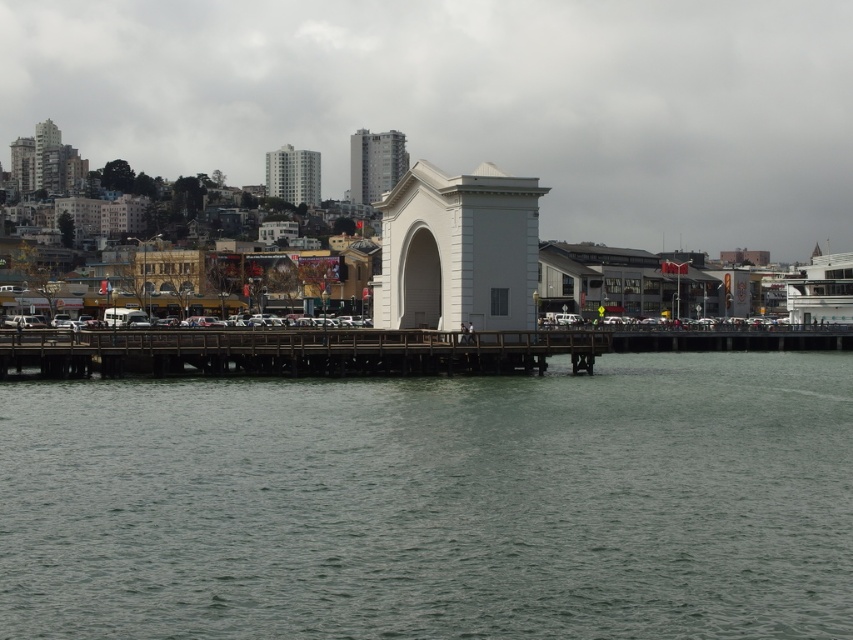
You are standing on the wooden pier and want to take a photo of the large white archway structure. To ensure the green water at lower center is in the foreground, where should you position yourself relative to the archway?

The green water at lower center is located at point (434, 502), so you should position yourself closer to the water to have it in the foreground while framing the archway in the background.

You are standing on the wooden pier where the large white archway structure is located. You notice a point marked at coordinates (434,502). Based on the scene description, what does this point indicate?

The point at coordinates (434,502) marks the location of green water at lower center.

In the scene shown: You are standing on the wooden bridge at center and want to reach the green water at lower center. Which direction should you move to get there?

→ The green water at lower center is to the right of the wooden bridge at center, so you should move to the right to reach it.